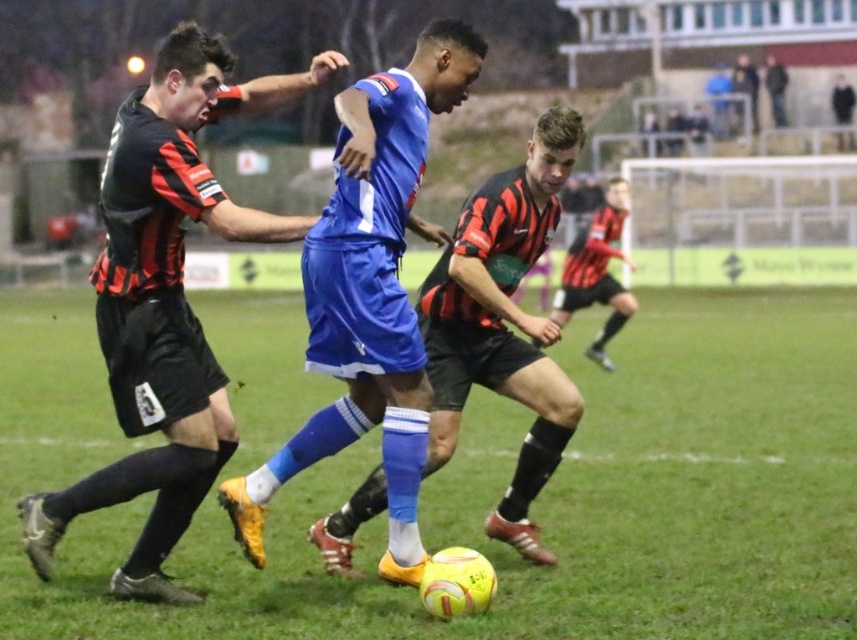
Question: Which point is farther to the camera?

Choices:
 (A) (x=181, y=220)
 (B) (x=324, y=388)
 (C) (x=324, y=444)
 (D) (x=488, y=531)

Answer: (B)

Question: Among these points, which one is nearest to the camera?

Choices:
 (A) (135, 364)
 (B) (526, 436)
 (C) (409, 435)
 (D) (111, 448)

Answer: (C)

Question: Does yellow matte soccer ball at center have a lesser width compared to blue matte soccer ball at center?

Choices:
 (A) no
 (B) yes

Answer: (A)

Question: Is yellow matte soccer ball at center smaller than blue matte soccer ball at center?

Choices:
 (A) no
 (B) yes

Answer: (A)

Question: Is black matte jersey at left further to the viewer compared to blue matte soccer ball at center?

Choices:
 (A) no
 (B) yes

Answer: (B)

Question: Estimate the real-world distances between objects in this image. Which object is closer to the blue matte shorts at center?

Choices:
 (A) blue matte soccer ball at center
 (B) black matte jersey at left
 (C) yellow matte soccer ball at center

Answer: (A)